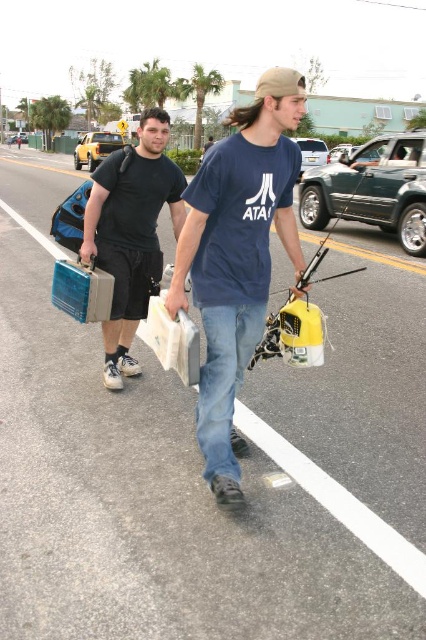
Question: Is matte blue shirt at center smaller than matte black t-shirt at center?

Choices:
 (A) yes
 (B) no

Answer: (B)

Question: Among these objects, which one is nearest to the camera?

Choices:
 (A) matte blue shirt at center
 (B) matte black t-shirt at center

Answer: (A)

Question: Is matte blue shirt at center above matte black t-shirt at center?

Choices:
 (A) yes
 (B) no

Answer: (B)

Question: Does matte blue shirt at center come in front of matte black t-shirt at center?

Choices:
 (A) yes
 (B) no

Answer: (A)

Question: Which point is farther to the camera?

Choices:
 (A) (114, 369)
 (B) (227, 410)

Answer: (A)

Question: Which point is farther to the camera?

Choices:
 (A) matte blue shirt at center
 (B) matte black t-shirt at center

Answer: (B)